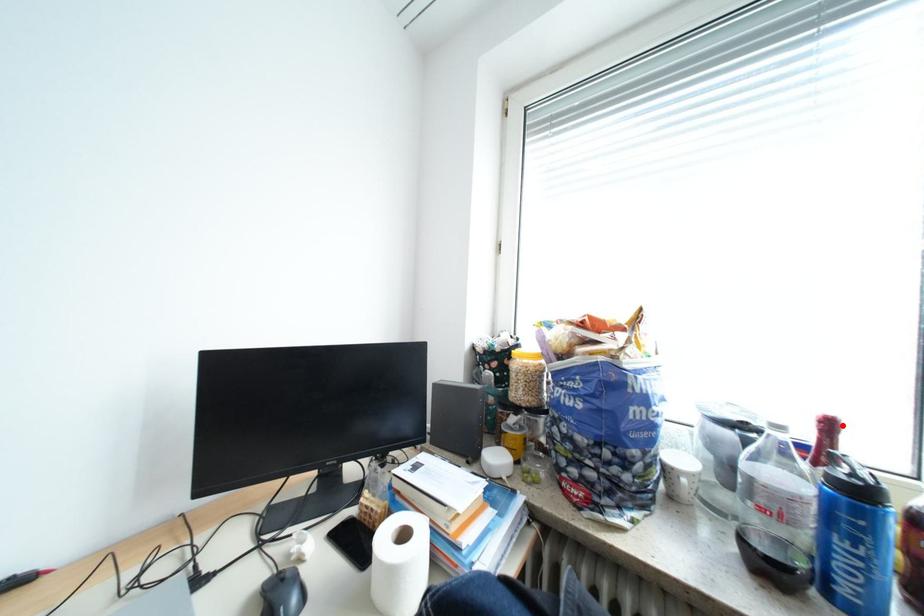
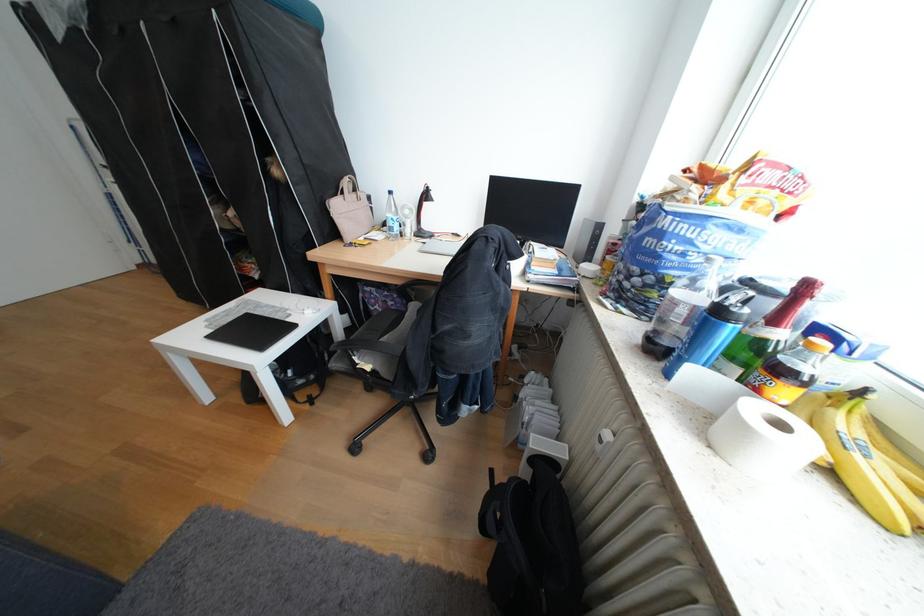
In the second image, find the point that corresponds to the highlighted location in the first image.

(819, 288)